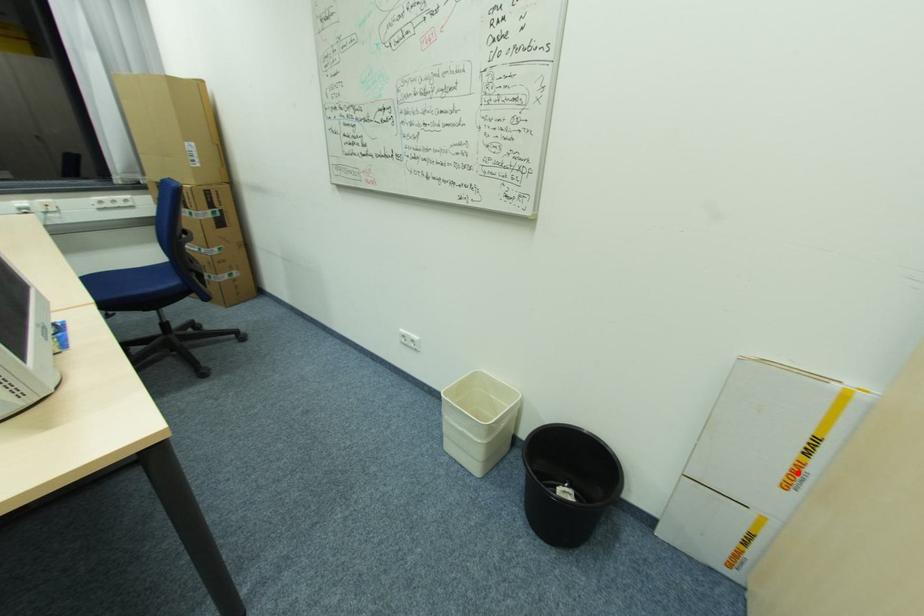
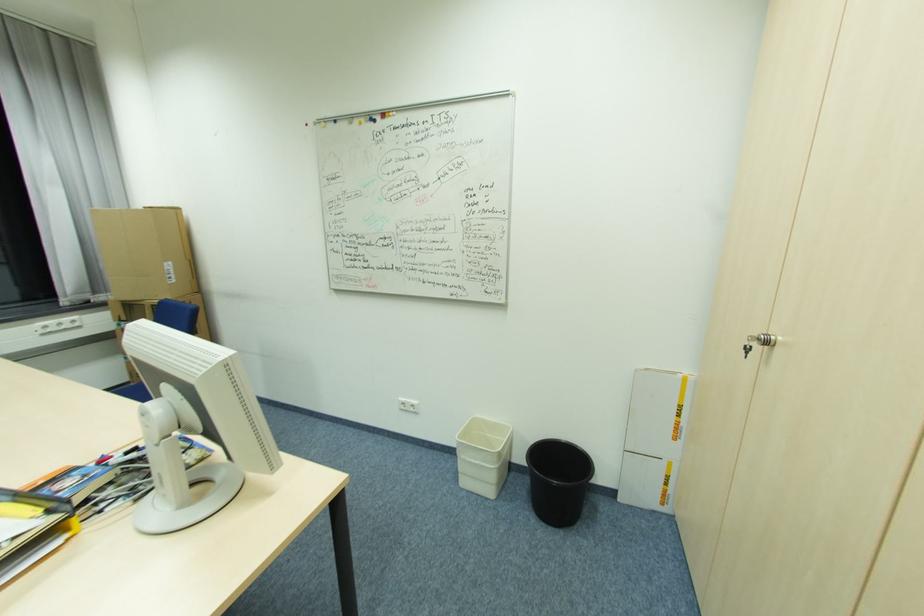
Question: I am providing you with two images of the same scene from different viewpoints. A red point is marked on the first image. At the location where the point appears in image 1, is it still visible in image 2?

Choices:
 (A) Yes
 (B) No

Answer: (A)